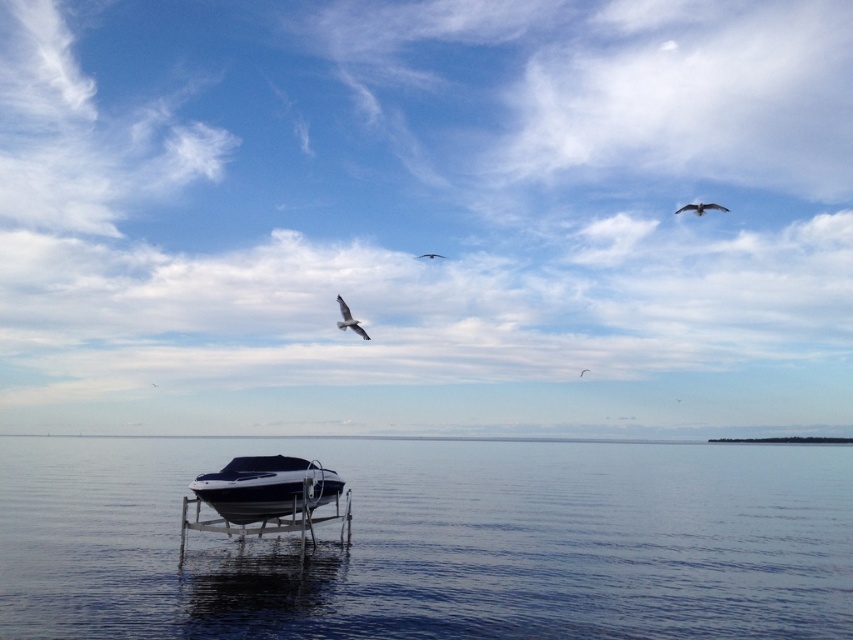
Between white glossy dock at lower center and white feathered bird at upper right, which one is positioned higher?

white feathered bird at upper right is above.

Can you confirm if white glossy dock at lower center is taller than white feathered bird at upper right?

In fact, white glossy dock at lower center may be shorter than white feathered bird at upper right.

Which is in front, point (196, 520) or point (689, 209)?

Point (196, 520) is more forward.

The height and width of the screenshot is (640, 853). I want to click on white glossy dock at lower center, so click(x=273, y=518).

Does glossy water at center have a greater height compared to white matte bird at center?

Indeed, glossy water at center has a greater height compared to white matte bird at center.

Where is `glossy water at center`? This screenshot has height=640, width=853. glossy water at center is located at coordinates [x=436, y=541].

Where is `glossy water at center`? This screenshot has height=640, width=853. glossy water at center is located at coordinates (436, 541).

Measure the distance from white feathered bird at center to white matte bird at center.

They are 143.81 meters apart.

Which is above, white feathered bird at center or white matte bird at center?

white matte bird at center is above.

Does point (352, 324) come closer to viewer compared to point (434, 253)?

Yes, it is in front of point (434, 253).

I want to click on white feathered bird at center, so click(349, 320).